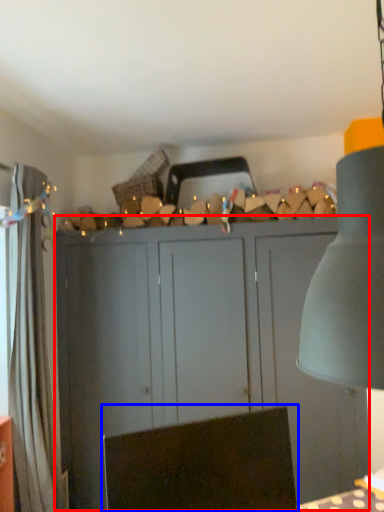
Question: Which point is further to the camera, cupboard (highlighted by a red box) or swivel chair (highlighted by a blue box)?

Choices:
 (A) cupboard
 (B) swivel chair

Answer: (A)